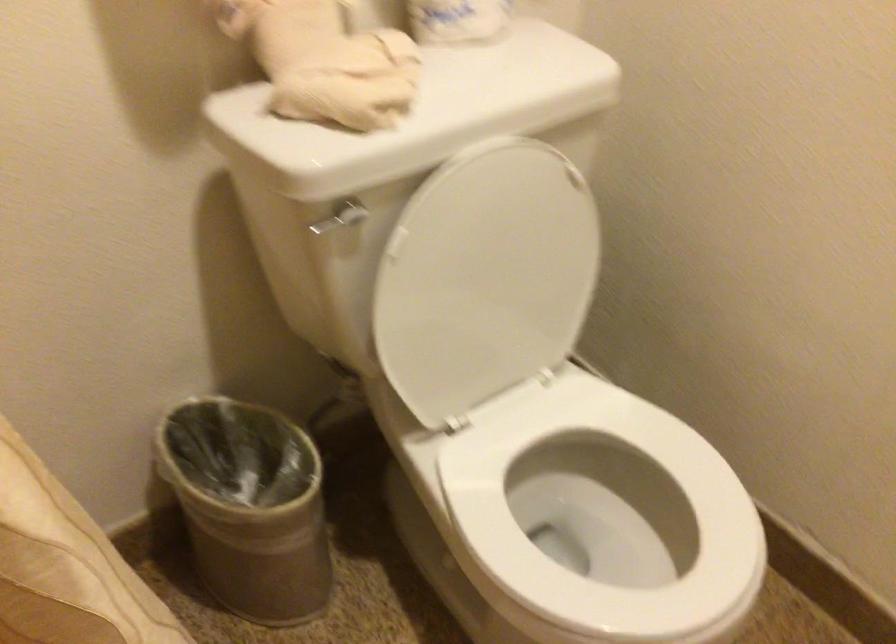
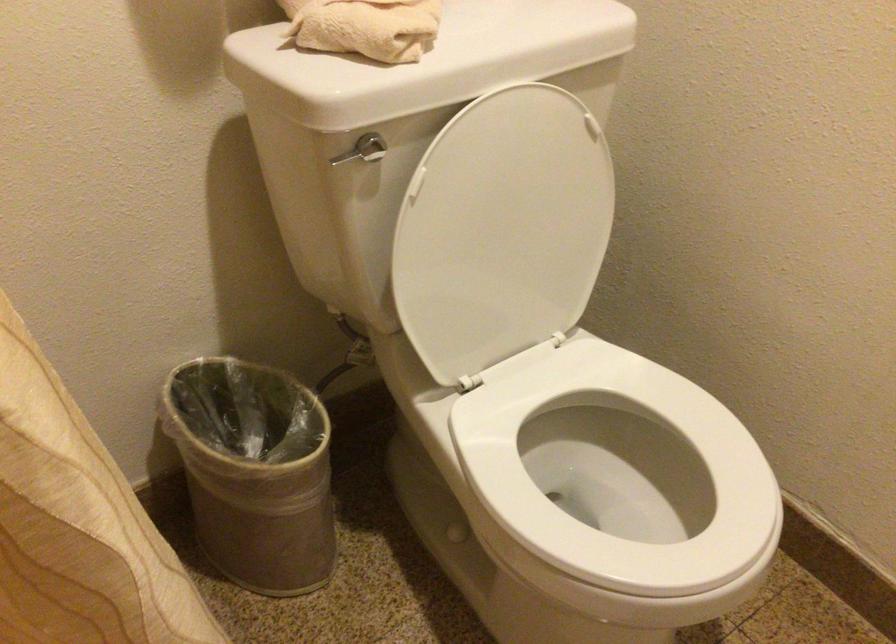
In the second image, find the point that corresponds to point 328,218 in the first image.

(348, 155)